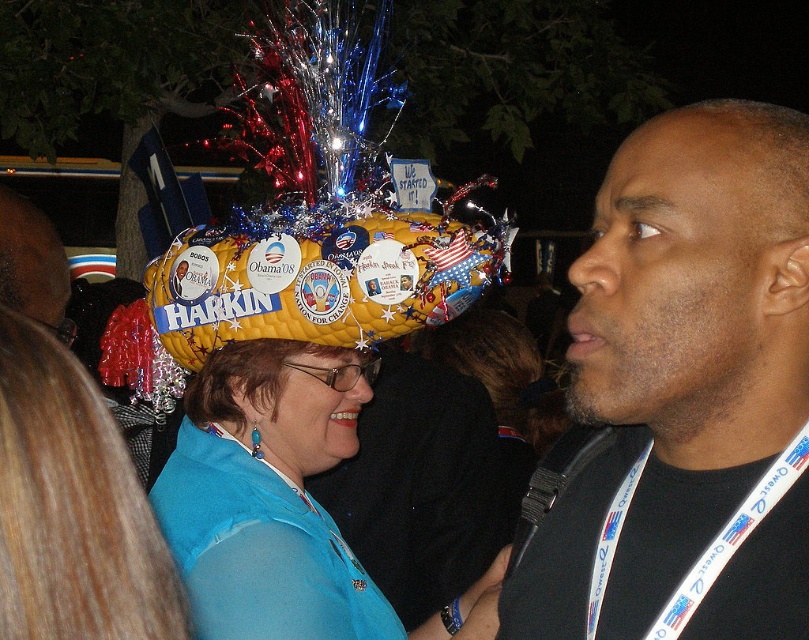
Question: Which point is closer to the camera?

Choices:
 (A) (346, 300)
 (B) (58, 579)

Answer: (B)

Question: Can you confirm if matte yellow hat at center is positioned below matte black hat at upper center?

Choices:
 (A) no
 (B) yes

Answer: (B)

Question: Observing the image, what is the correct spatial positioning of black lanyard at right in reference to white plastic lanyard at lower right?

Choices:
 (A) right
 (B) left

Answer: (B)

Question: Which point appears closest to the camera in this image?

Choices:
 (A) (680, 266)
 (B) (87, 388)
 (C) (3, 301)
 (D) (691, 131)

Answer: (B)

Question: Which object is positioned farthest from the matte black hat at upper center?

Choices:
 (A) matte yellow hat at center
 (B) bald head at center
 (C) yellow quilted hat at center

Answer: (B)

Question: Is black lanyard at right smaller than blue fabric shirt at center?

Choices:
 (A) yes
 (B) no

Answer: (B)